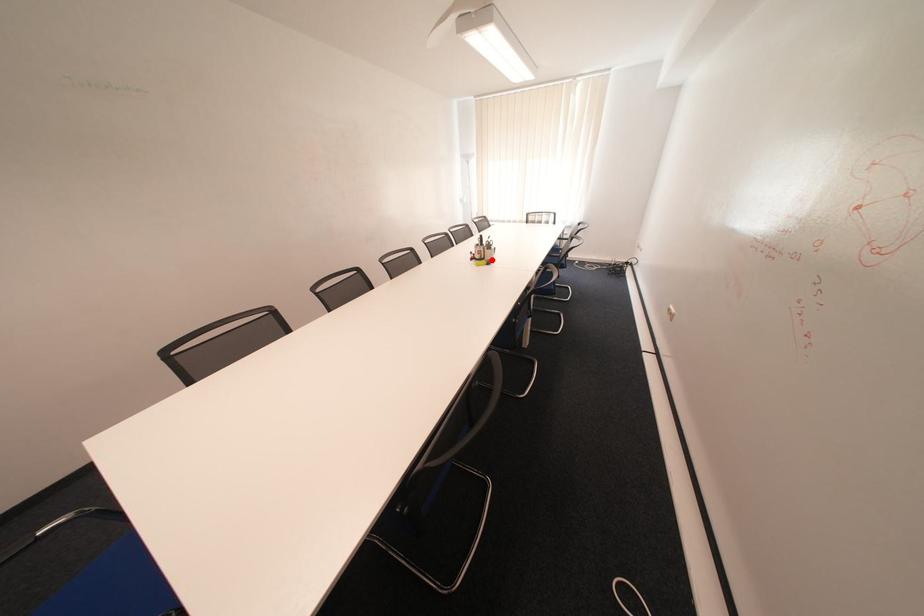
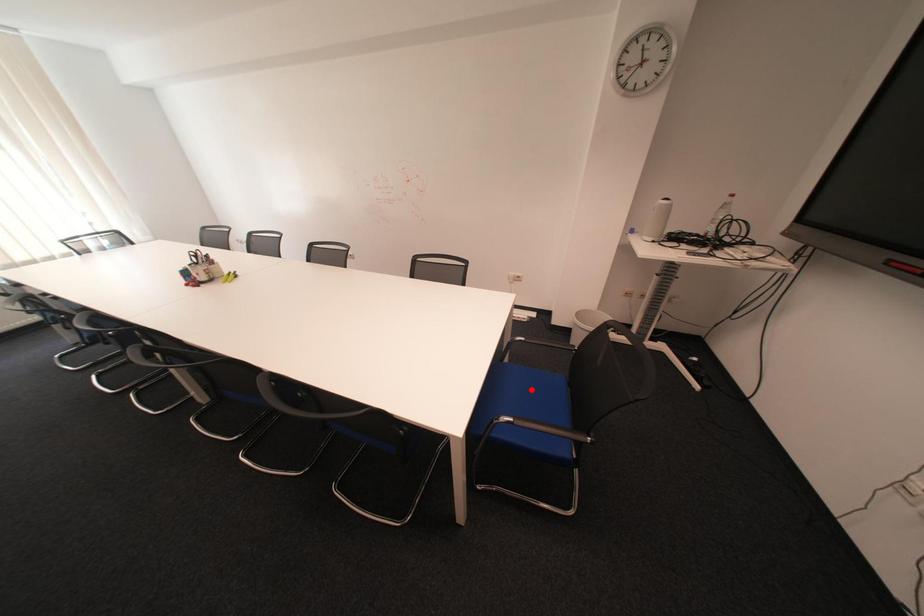
I am providing you with two images of the same scene from different viewpoints. A red point is marked on the first image and another point is marked on the second image. Do the highlighted points in image1 and image2 indicate the same real-world spot?

No